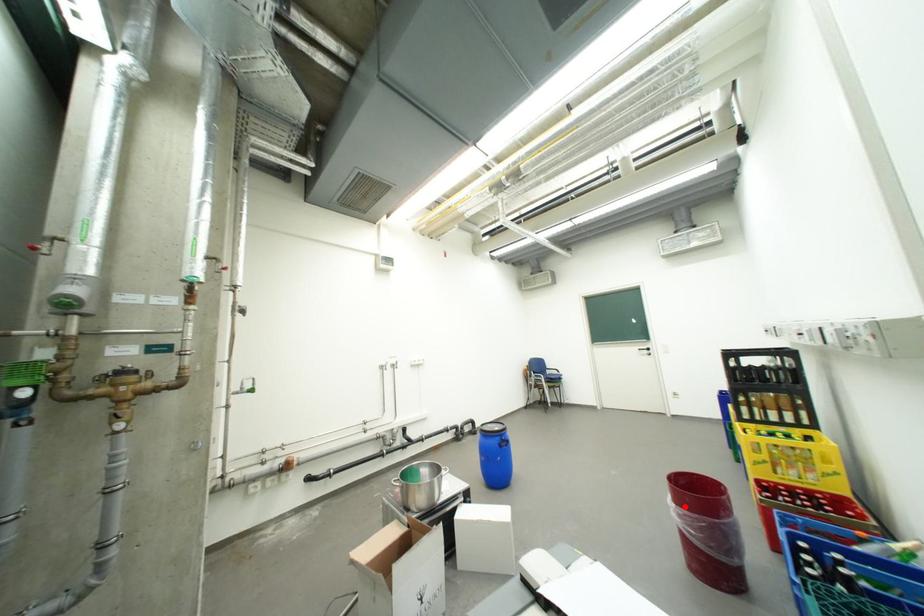
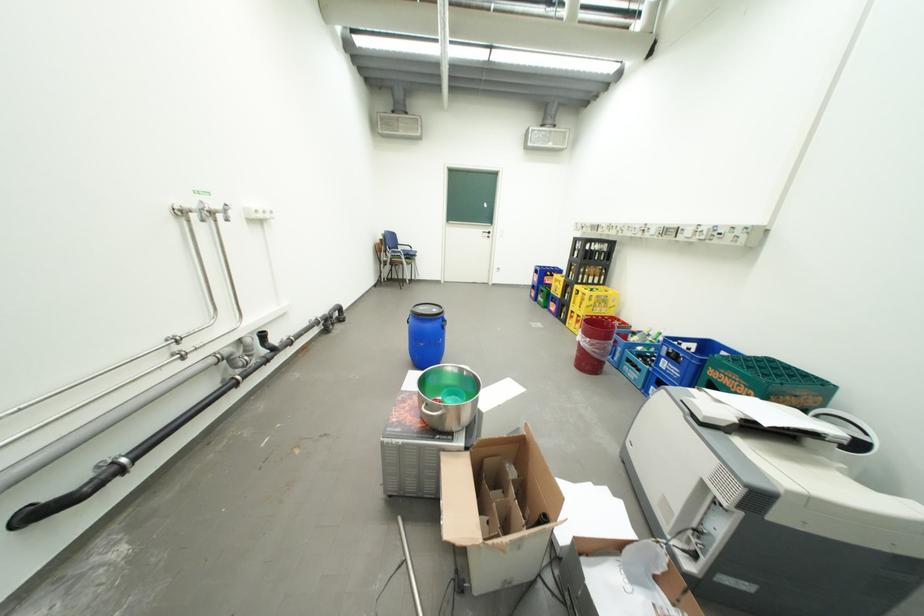
Question: I am providing you with two images of the same scene from different viewpoints. In image1, a red point is highlighted. Considering the same 3D point in image2, which of the following is correct?

Choices:
 (A) It is closer
 (B) It is farther

Answer: (A)